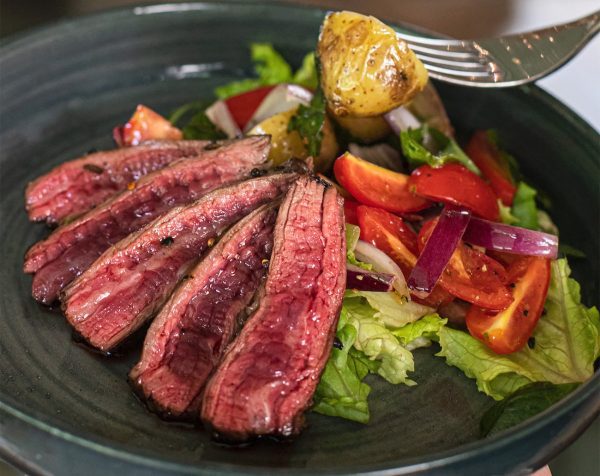
At what (x,y) coordinates should I click in order to perform the action: click on plate. Please return your answer as a coordinate pair (x, y). The width and height of the screenshot is (600, 476). Looking at the image, I should click on (435, 454).